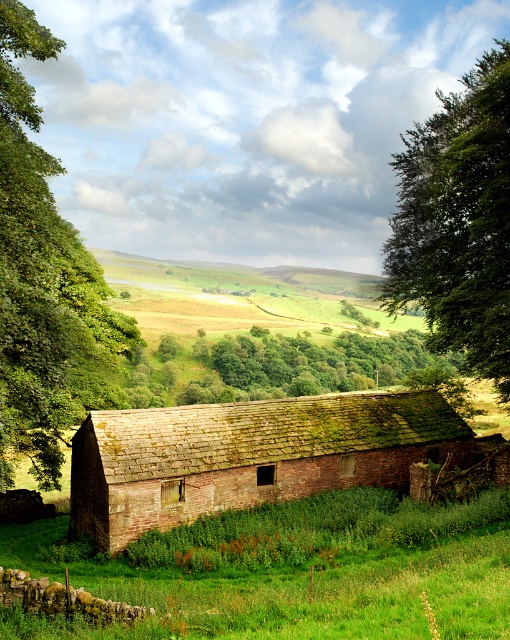
Question: Can you confirm if green leafy tree at left is wider than green leafy tree at upper right?

Choices:
 (A) no
 (B) yes

Answer: (A)

Question: Estimate the real-world distances between objects in this image. Which object is closer to the green leafy tree at left?

Choices:
 (A) green leafy tree at upper right
 (B) green grassy at lower center

Answer: (B)

Question: Which of the following is the farthest from the observer?

Choices:
 (A) (373, 435)
 (B) (32, 451)

Answer: (B)

Question: Can you confirm if green grassy at lower center is positioned to the left of brown brick barn at center?

Choices:
 (A) no
 (B) yes

Answer: (B)

Question: Which of the following is the farthest from the observer?

Choices:
 (A) (122, 346)
 (B) (211, 472)

Answer: (A)

Question: Is green leafy tree at left further to camera compared to green leafy tree at upper right?

Choices:
 (A) no
 (B) yes

Answer: (A)